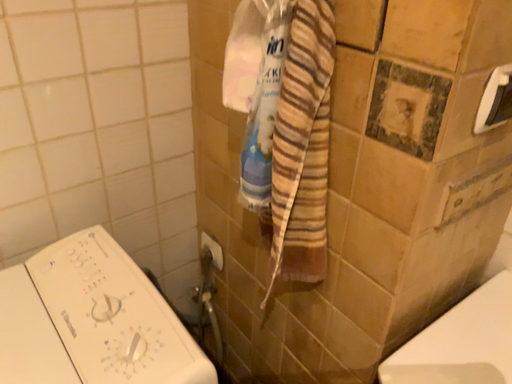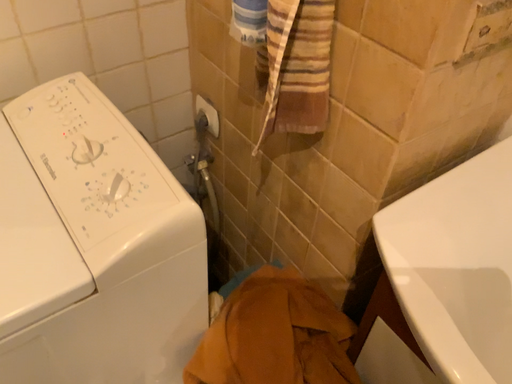
Question: How did the camera likely rotate when shooting the video?

Choices:
 (A) rotated downward
 (B) rotated upward

Answer: (A)